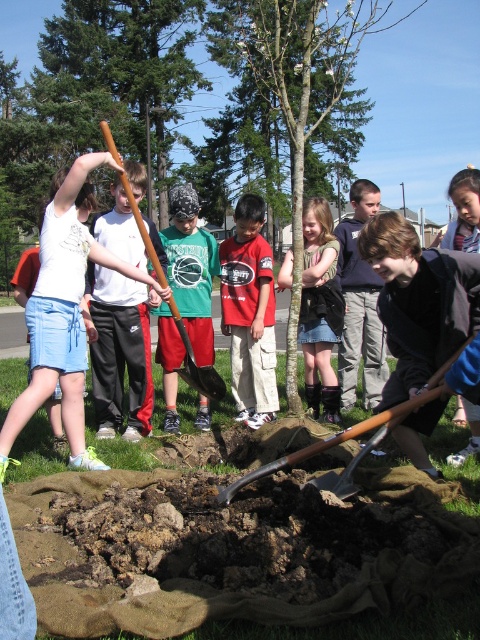
Is the position of green jersey at center less distant than that of wooden shovel at lower center?

That is False.

Looking at this image, who is more forward, (187, 182) or (330, 486)?

Point (330, 486)

Locate an element on the screen. This screenshot has width=480, height=640. green jersey at center is located at coordinates (191, 269).

What do you see at coordinates (63, 308) in the screenshot? I see `white cotton shirt at upper left` at bounding box center [63, 308].

Does white cotton shirt at upper left have a greater width compared to matte black shirt at center?

Correct, the width of white cotton shirt at upper left exceeds that of matte black shirt at center.

This screenshot has height=640, width=480. I want to click on white cotton shirt at upper left, so click(x=63, y=308).

Is white cotton shirt at upper left further to the viewer compared to red cotton shirt at center?

No, it is in front of red cotton shirt at center.

Describe the element at coordinates (63, 308) in the screenshot. Image resolution: width=480 pixels, height=640 pixels. I see `white cotton shirt at upper left` at that location.

Identify the location of white cotton shirt at upper left. (63, 308).

You are a GUI agent. You are given a task and a screenshot of the screen. Output one action in this format:
    pyautogui.click(x=<x>, y=<y>)
    Task: Click on the white cotton shirt at upper left
    The image size is (480, 640).
    Given the screenshot: What is the action you would take?
    pyautogui.click(x=63, y=308)